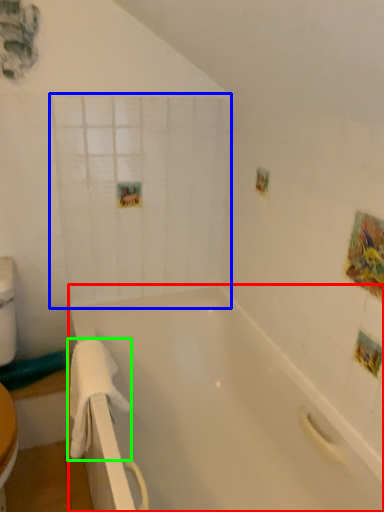
Question: Which is nearer to the bathtub (highlighted by a red box)? glass door (highlighted by a blue box) or towel/napkin (highlighted by a green box).

Choices:
 (A) glass door
 (B) towel/napkin

Answer: (B)